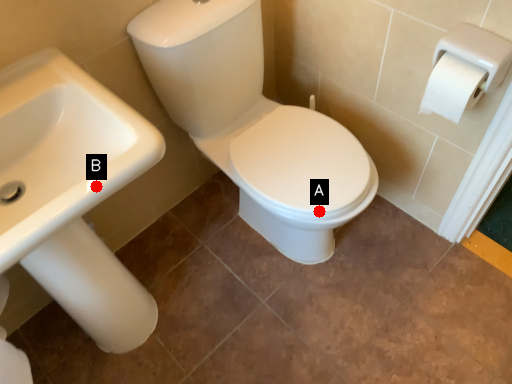
Question: Two points are circled on the image, labeled by A and B beside each circle. Which point appears closest to the camera in this image?

Choices:
 (A) A is closer
 (B) B is closer

Answer: (B)